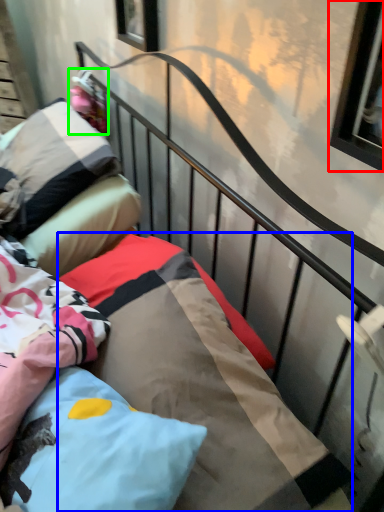
Question: Which object is positioned closest to window (highlighted by a red box)? Select from mattress (highlighted by a blue box) and doll (highlighted by a green box).

Choices:
 (A) mattress
 (B) doll

Answer: (A)